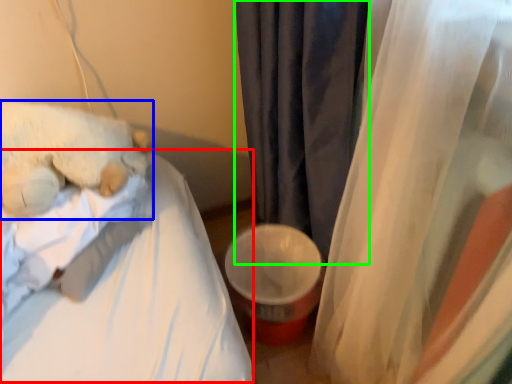
Question: Which is farther away from mattress (highlighted by a red box)? teddy bear (highlighted by a blue box) or curtain (highlighted by a green box)?

Choices:
 (A) teddy bear
 (B) curtain

Answer: (B)